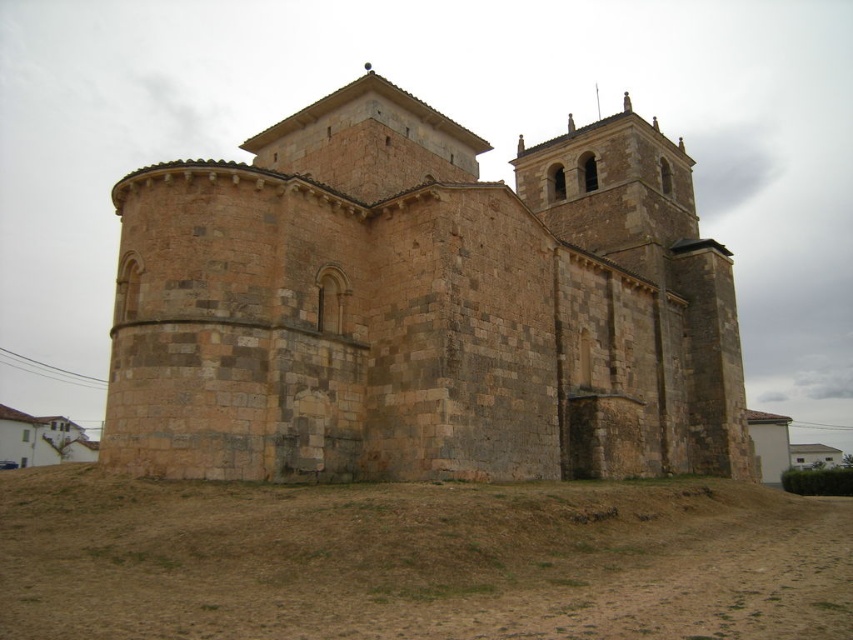
Does brown stone church at center appear under brown sandy dirt field at lower center?

Incorrect, brown stone church at center is not positioned below brown sandy dirt field at lower center.

Is point (548, 205) positioned behind point (577, 600)?

Yes, it is behind point (577, 600).

The image size is (853, 640). I want to click on brown stone church at center, so click(422, 307).